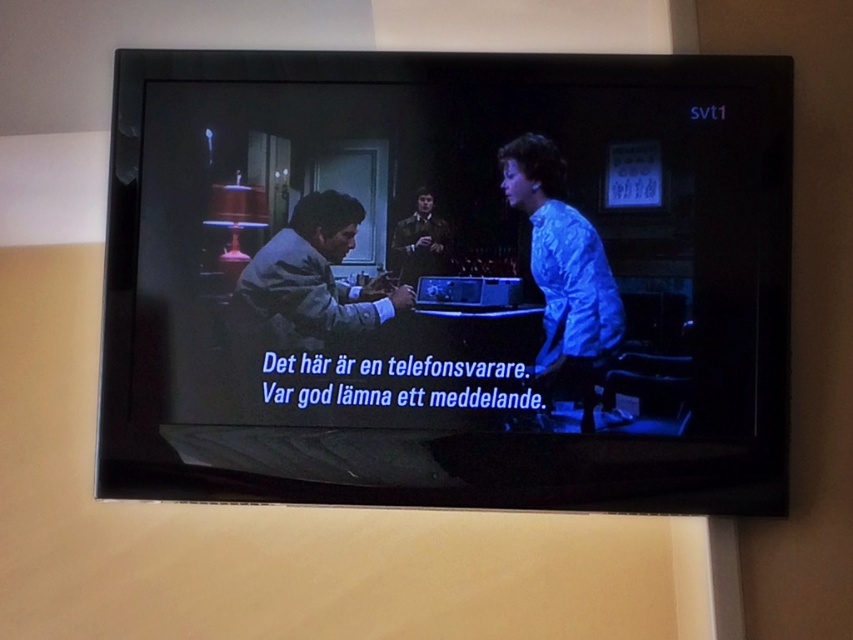
You are a person standing in front of the television and you want to touch both the matte black television at center and the gray fabric shirt at center. Which object do you need to reach down to touch first?

The matte black television at center is located below the gray fabric shirt at center, so you need to reach down to touch the matte black television at center first before reaching up for the gray fabric shirt at center.

You are trying to decide whether to place a decorative plate on the shelf next to the matte black television at center. The plate is the same size as the blue satin blouse at center. Will the plate fit on the shelf if the shelf can only accommodate items smaller than the television?

The matte black television at center has a larger size compared to the blue satin blouse at center. Since the plate is the same size as the blue satin blouse at center, it will fit on the shelf because it is smaller than the television.

You are trying to decide whether to place a new decorative item on the matte black television at center or on the shiny black suit at center. Based on their sizes, which object would be more suitable for placing a larger decorative item?

The matte black television at center has a larger size compared to the shiny black suit at center, so it would be more suitable for placing a larger decorative item.